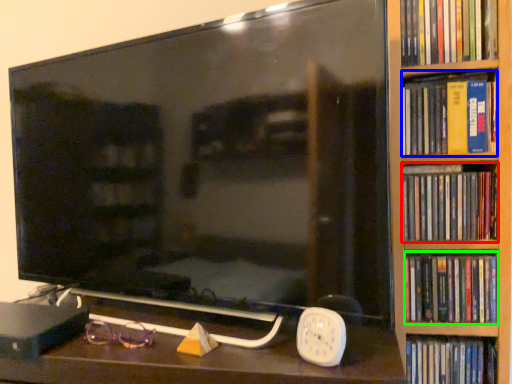
Question: Considering the real-world distances, which object is closest to book (highlighted by a red box)? book (highlighted by a blue box) or book (highlighted by a green box).

Choices:
 (A) book
 (B) book

Answer: (B)